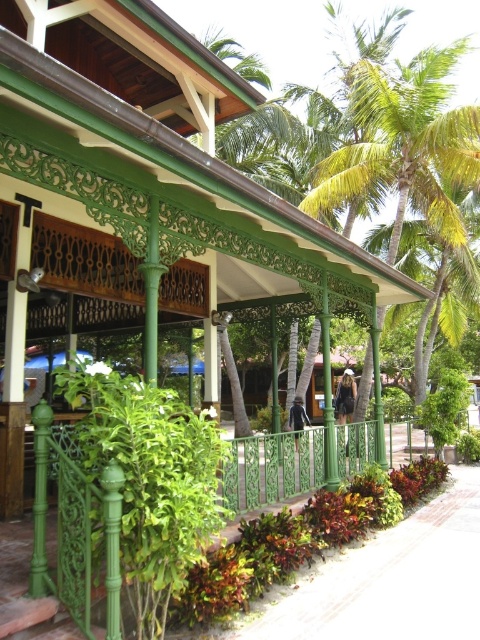
Which is below, green leafy palm tree at center or green wrought iron fence at lower left?

green wrought iron fence at lower left is lower down.

Does green leafy palm tree at center appear on the left side of green wrought iron fence at lower left?

Incorrect, green leafy palm tree at center is not on the left side of green wrought iron fence at lower left.

You are a GUI agent. You are given a task and a screenshot of the screen. Output one action in this format:
    pyautogui.click(x=<x>, y=<y>)
    Task: Click on the green leafy palm tree at center
    
    Given the screenshot: What is the action you would take?
    pyautogui.click(x=405, y=141)

Does dark brown leather jacket at center have a lesser height compared to dark blue fabric at center?

Yes, dark brown leather jacket at center is shorter than dark blue fabric at center.

Who is taller, dark brown leather jacket at center or dark blue fabric at center?

Standing taller between the two is dark blue fabric at center.

Image resolution: width=480 pixels, height=640 pixels. Describe the element at coordinates (346, 396) in the screenshot. I see `dark brown leather jacket at center` at that location.

This screenshot has height=640, width=480. In order to click on dark brown leather jacket at center in this screenshot , I will do `click(346, 396)`.

Can you confirm if green leafy palm tree at center is taller than dark brown leather jacket at center?

Incorrect, green leafy palm tree at center's height is not larger of dark brown leather jacket at center's.

Is point (372, 163) more distant than point (346, 451)?

Yes.

Where is `green leafy palm tree at center`? Image resolution: width=480 pixels, height=640 pixels. green leafy palm tree at center is located at coordinates (405, 141).